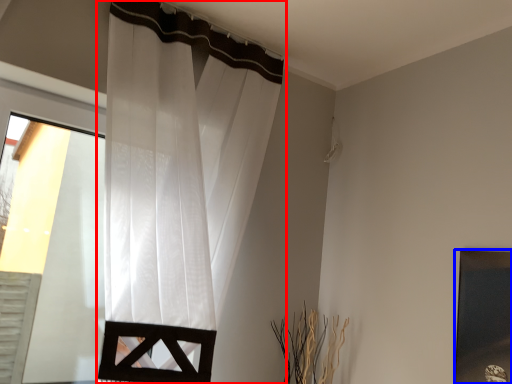
Question: Which point is further to the camera, curtain (highlighted by a red box) or picture frame (highlighted by a blue box)?

Choices:
 (A) curtain
 (B) picture frame

Answer: (B)